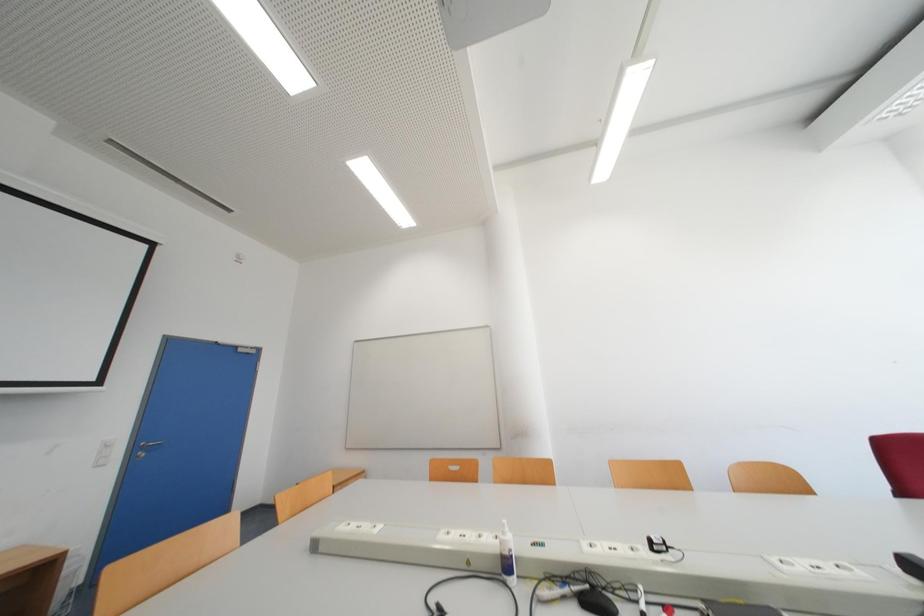
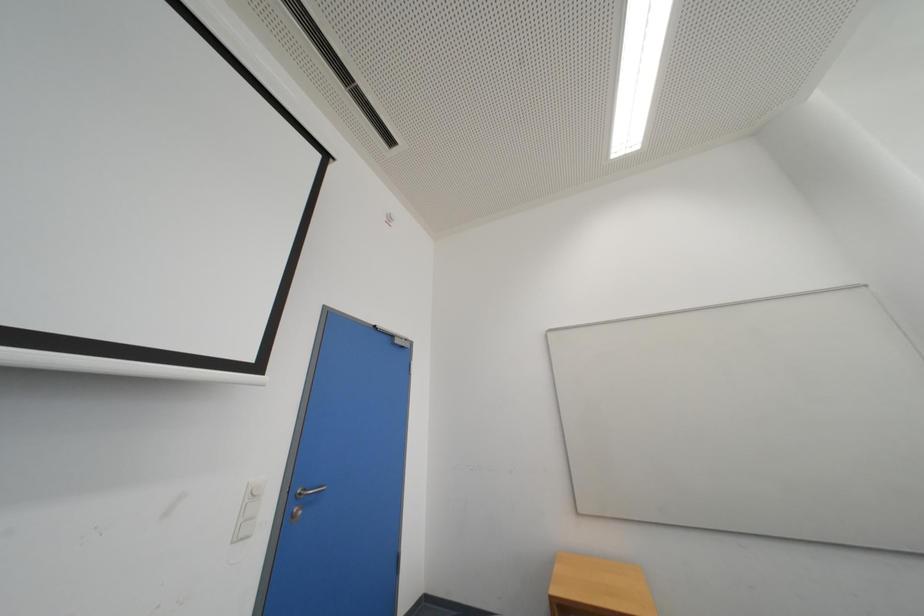
Which direction would the cameraman need to move to produce the second image?

The cameraman moved toward left, forward.